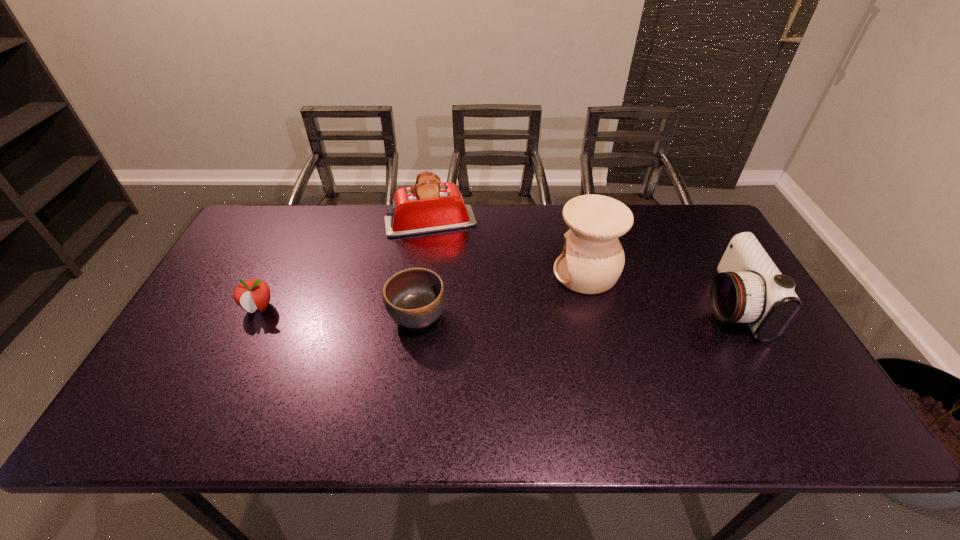
The width and height of the screenshot is (960, 540). Identify the location of blank space located 0.280m on the surface of the rightmost object. (603, 305).

Identify the location of vacant region located on the surface of the rightmost object. (600, 305).

Where is `vacant space located 0.080m on the surface of the rightmost object`? vacant space located 0.080m on the surface of the rightmost object is located at coordinates (676, 305).

The height and width of the screenshot is (540, 960). What are the coordinates of `free space located 0.170m on the back of the bowl` in the screenshot? It's located at (425, 255).

This screenshot has height=540, width=960. Identify the location of vacant region located 0.380m on the right of the leftmost object. pos(415,307).

The height and width of the screenshot is (540, 960). What are the coordinates of `object located in the far edge section of the desktop` in the screenshot? It's located at (429, 206).

Identify the location of object located at the left edge. (252, 294).

The height and width of the screenshot is (540, 960). What are the coordinates of `object located at the right edge` in the screenshot? It's located at (749, 288).

Find the location of `vacant space at the far edge`. vacant space at the far edge is located at coordinates (365, 231).

The width and height of the screenshot is (960, 540). What are the coordinates of `free spot at the near edge of the desktop` in the screenshot? It's located at (444, 426).